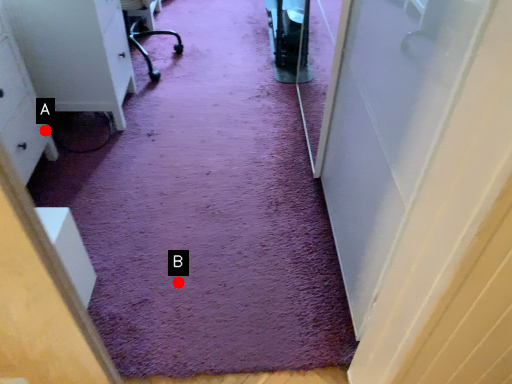
Question: Two points are circled on the image, labeled by A and B beside each circle. Among these points, which one is farthest from the camera?

Choices:
 (A) A is further
 (B) B is further

Answer: (A)